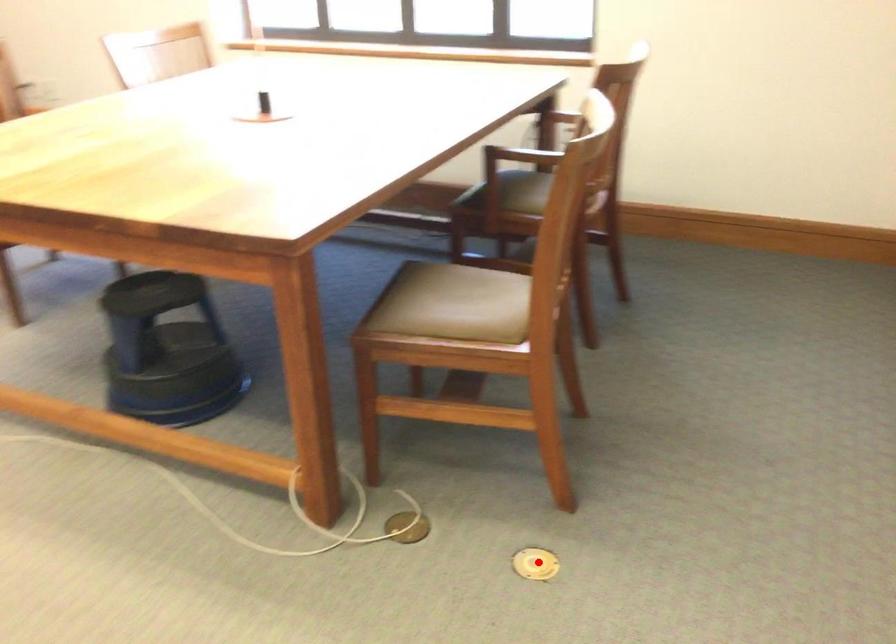
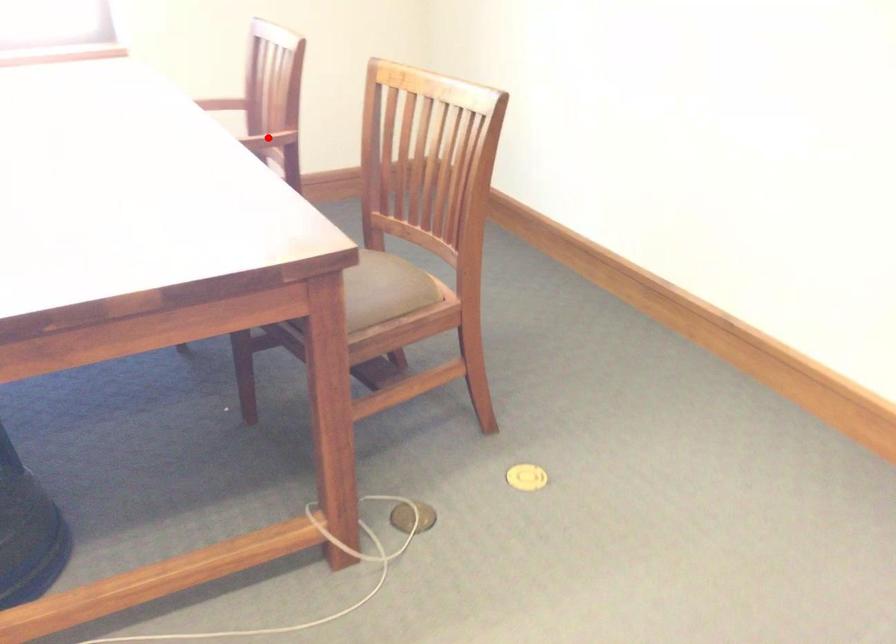
I am providing you with two images of the same scene from different viewpoints. A red point is marked on the first image and another point is marked on the second image. Do the highlighted points in image1 and image2 indicate the same real-world spot?

No